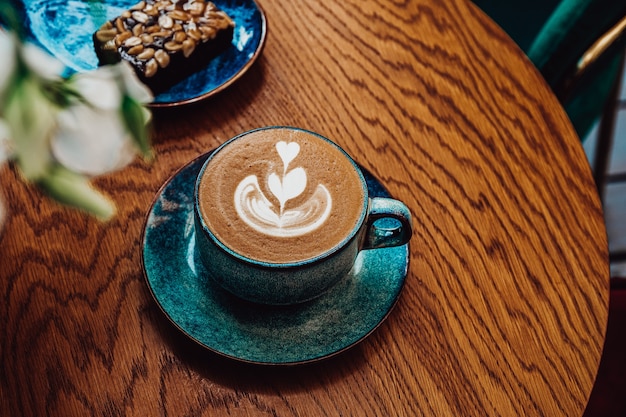
Identify the location of table. (436, 144).